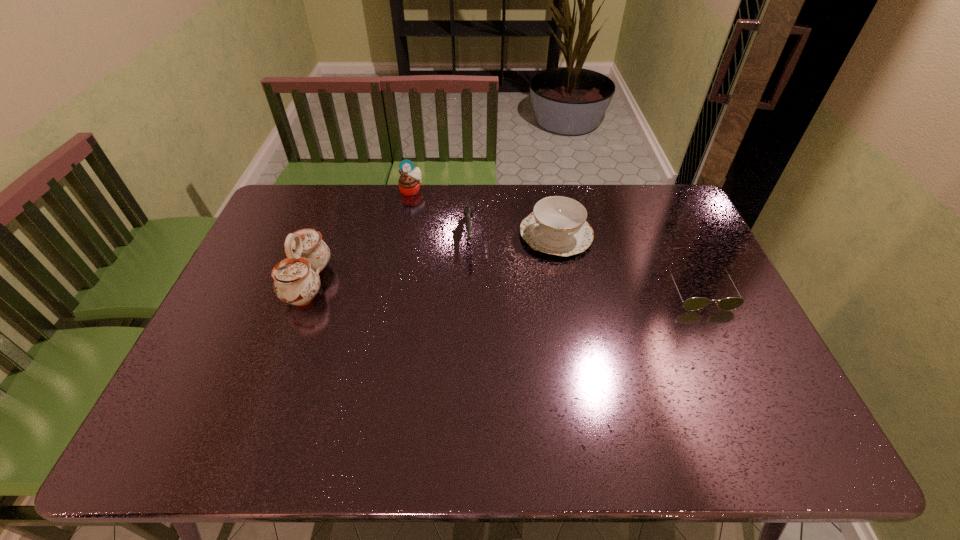
Locate an element on the screen. This screenshot has width=960, height=540. gun that is at the far edge is located at coordinates (467, 210).

Locate an element on the screen. The image size is (960, 540). chinaware located in the far edge section of the desktop is located at coordinates (557, 225).

The width and height of the screenshot is (960, 540). I want to click on muffin present at the far edge, so click(x=409, y=182).

At what (x,y) coordinates should I click in order to perform the action: click on object present at the left edge. Please return your answer as a coordinate pair (x, y). Looking at the image, I should click on (296, 279).

I want to click on object that is at the right edge, so click(x=696, y=303).

Locate an element on the screen. This screenshot has width=960, height=540. free space at the far edge is located at coordinates (517, 222).

This screenshot has height=540, width=960. Find the location of `vacant area at the near edge of the desktop`. vacant area at the near edge of the desktop is located at coordinates (456, 390).

In the image, there is a desktop. Find the location of `vacant space at the left edge`. vacant space at the left edge is located at coordinates (262, 246).

Locate an element on the screen. vacant space at the right edge of the desktop is located at coordinates (705, 346).

The width and height of the screenshot is (960, 540). In order to click on free region at the far left corner in this screenshot , I will do `click(320, 205)`.